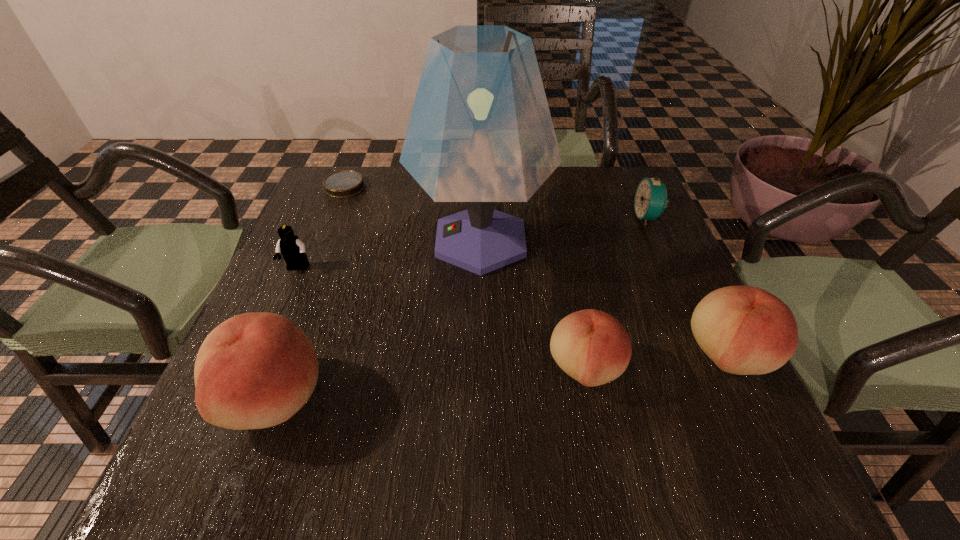
What are the coordinates of `object situated at the near right corner` in the screenshot? It's located at (744, 330).

The height and width of the screenshot is (540, 960). In the image, there is a desktop. Find the location of `vacant space at the far edge`. vacant space at the far edge is located at coordinates (559, 181).

In the image, there is a desktop. Where is `blank space at the near edge`? Image resolution: width=960 pixels, height=540 pixels. blank space at the near edge is located at coordinates (612, 415).

In the image, there is a desktop. Find the location of `vacant area at the left edge`. vacant area at the left edge is located at coordinates (354, 246).

Image resolution: width=960 pixels, height=540 pixels. Find the location of `vacant space at the right edge of the desktop`. vacant space at the right edge of the desktop is located at coordinates (677, 350).

Where is `free space at the far right corner`? free space at the far right corner is located at coordinates (635, 170).

I want to click on free space at the near right corner of the desktop, so click(699, 420).

Where is `empty space between the rightmost peach and the Lego`? This screenshot has height=540, width=960. empty space between the rightmost peach and the Lego is located at coordinates (513, 312).

Locate an element on the screen. empty location between the Lego and the tallest object is located at coordinates (389, 255).

Identify the location of vacant space that is in between the Lego and the tallest object. (389, 255).